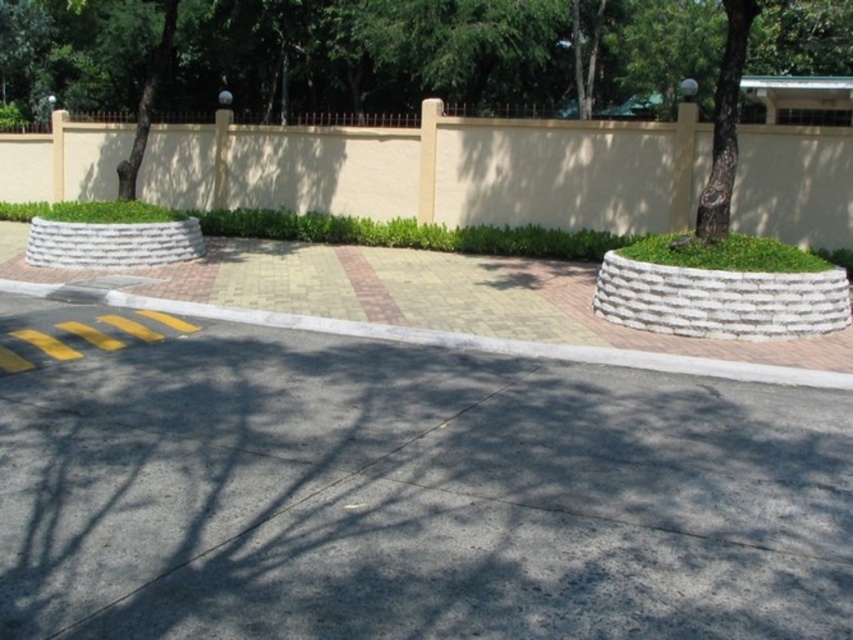
From the picture: Does beige concrete wall at upper center have a lesser height compared to yellow brick curb at center?

No.

Between beige concrete wall at upper center and yellow brick curb at center, which one appears on the right side from the viewer's perspective?

Positioned to the right is yellow brick curb at center.

Is point (38, 198) closer to viewer compared to point (717, 358)?

No.

The image size is (853, 640). Find the location of `beige concrete wall at upper center`. beige concrete wall at upper center is located at coordinates (440, 170).

Does gray asphalt pavement at center come in front of yellow brick curb at center?

Yes, it is in front of yellow brick curb at center.

Is point (643, 429) less distant than point (619, 362)?

Yes.

Image resolution: width=853 pixels, height=640 pixels. What are the coordinates of `gray asphalt pavement at center` in the screenshot? It's located at (415, 497).

Between point (825, 392) and point (3, 156), which one is positioned in front?

Positioned in front is point (825, 392).

Where is `gray asphalt pavement at center`? The height and width of the screenshot is (640, 853). gray asphalt pavement at center is located at coordinates (415, 497).